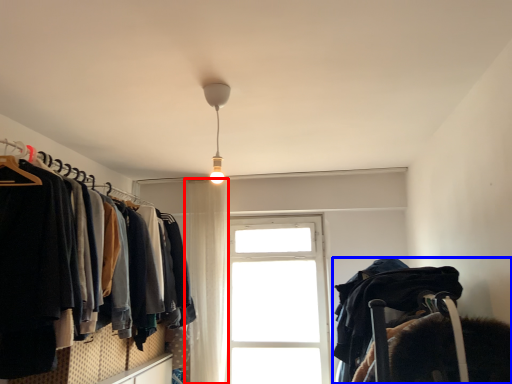
Question: Which object appears closest to the camera in this image, curtain (highlighted by a red box) or bunk bed (highlighted by a blue box)?

Choices:
 (A) curtain
 (B) bunk bed

Answer: (B)